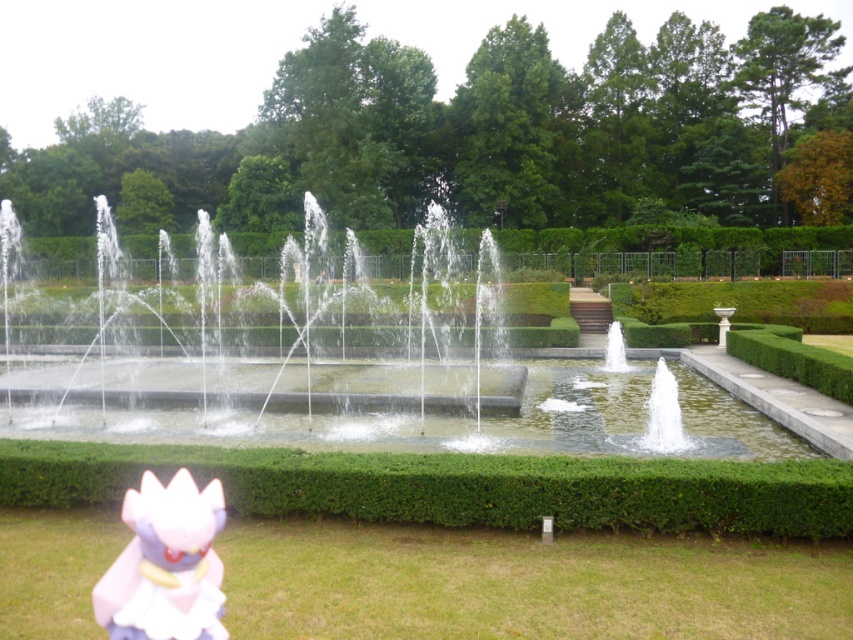
Question: Does pink matte plush at lower left have a smaller size compared to clear glass water at center?

Choices:
 (A) no
 (B) yes

Answer: (B)

Question: Is pink matte plush at lower left wider than clear glass water at center?

Choices:
 (A) no
 (B) yes

Answer: (A)

Question: Where is pink matte plush at lower left located in relation to clear glass water at center in the image?

Choices:
 (A) right
 (B) left

Answer: (B)

Question: Which point appears closest to the camera in this image?

Choices:
 (A) (212, 563)
 (B) (610, 349)

Answer: (A)

Question: Which of the following is the closest to the observer?

Choices:
 (A) (157, 628)
 (B) (619, 326)

Answer: (A)